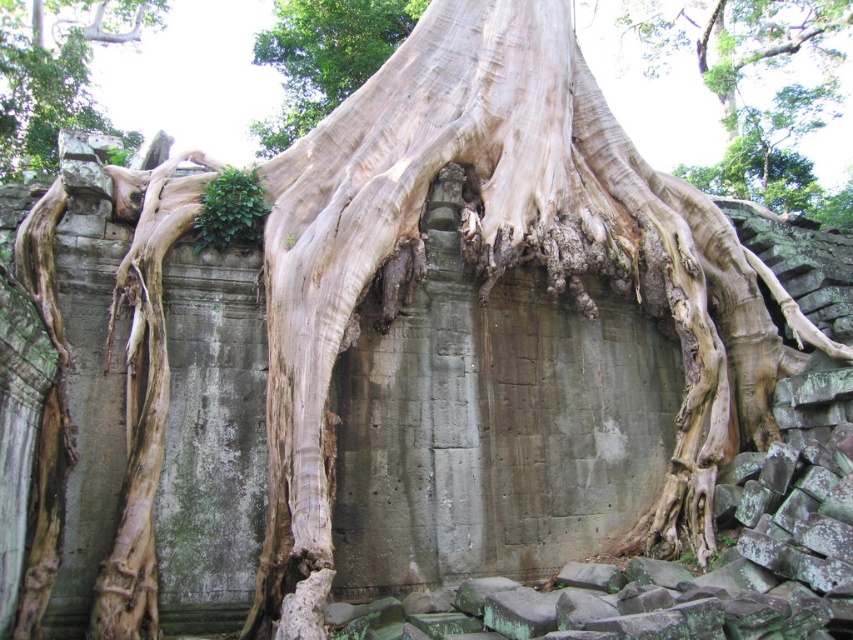
Question: Is smooth bark tree trunk at upper left to the right of smooth bark tree trunk at center from the viewer's perspective?

Choices:
 (A) no
 (B) yes

Answer: (A)

Question: Which of the following is the closest to the observer?

Choices:
 (A) click(x=318, y=68)
 (B) click(x=74, y=77)

Answer: (A)

Question: Is smooth bark tree trunk at upper left behind smooth bark tree trunk at center?

Choices:
 (A) yes
 (B) no

Answer: (B)

Question: Which point is closer to the camera?

Choices:
 (A) smooth bark tree trunk at upper left
 (B) smooth bark tree trunk at center

Answer: (A)

Question: Can you confirm if smooth bark tree trunk at upper left is thinner than smooth bark tree trunk at center?

Choices:
 (A) yes
 (B) no

Answer: (A)